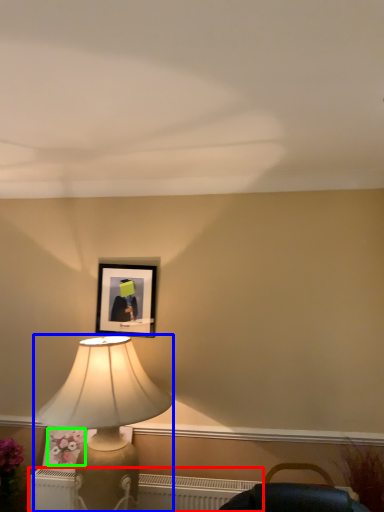
Question: Which is nearer to the radiator (highlighted by a red box)? lamp (highlighted by a blue box) or flower (highlighted by a green box).

Choices:
 (A) lamp
 (B) flower

Answer: (B)